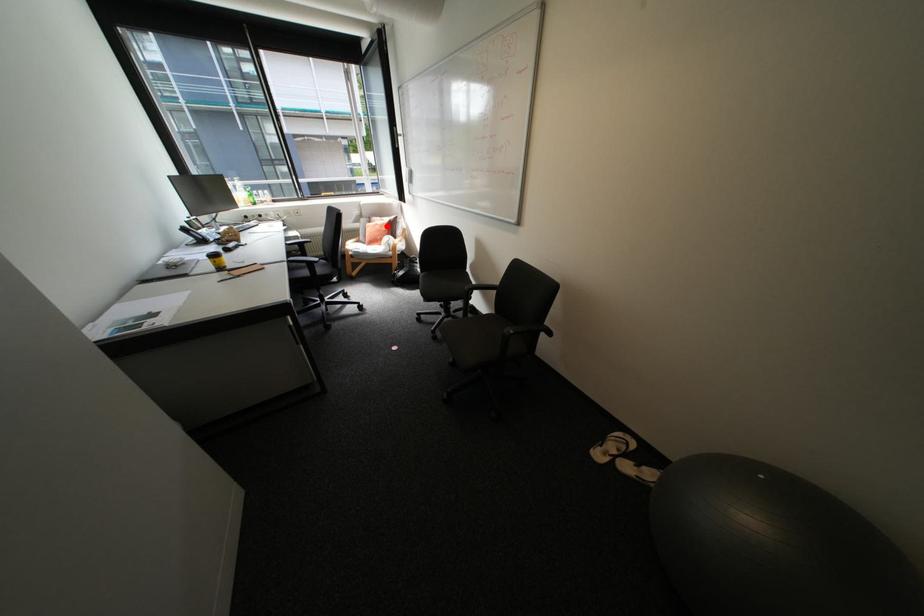
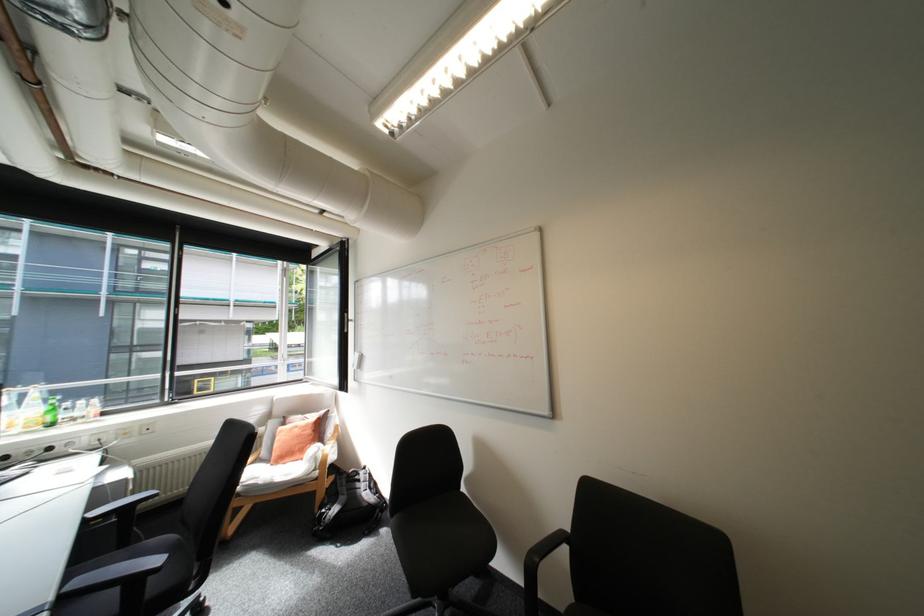
Question: I am providing you with two images of the same scene from different viewpoints. A red point is shown in image1. For the corresponding object point in image2, is it positioned nearer or farther from the camera?

Choices:
 (A) Nearer
 (B) Farther

Answer: (B)